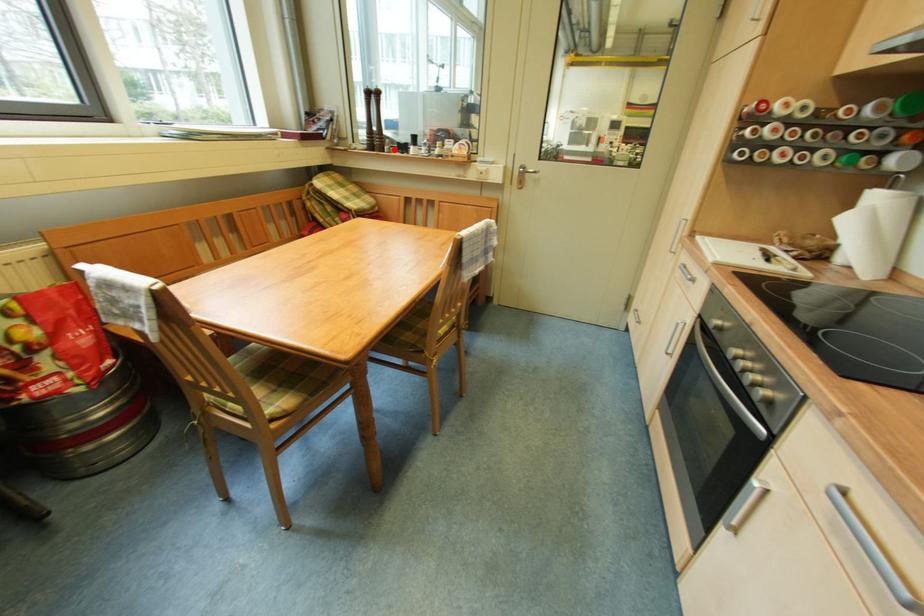
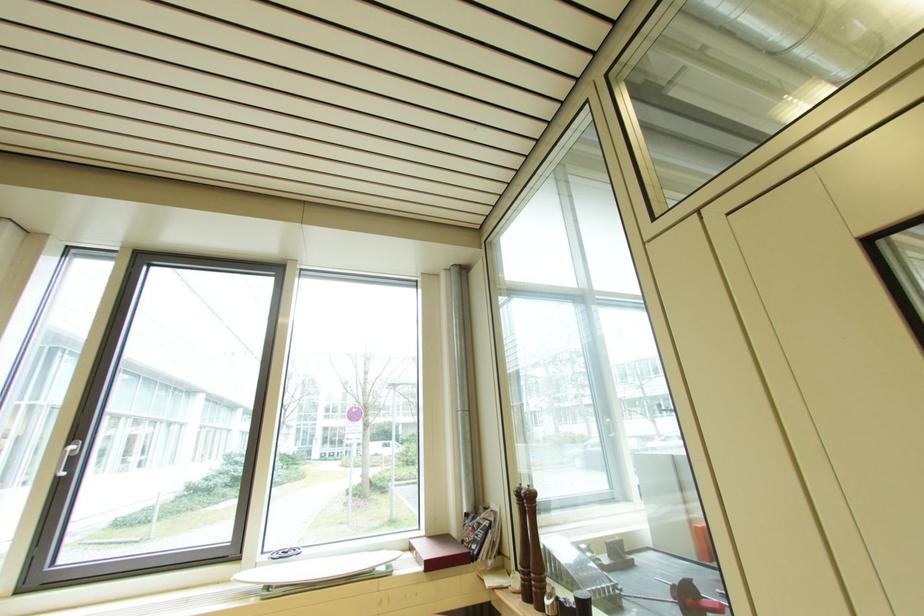
Find the pixel in the second image that matches the highlighted location in the first image.

(554, 605)